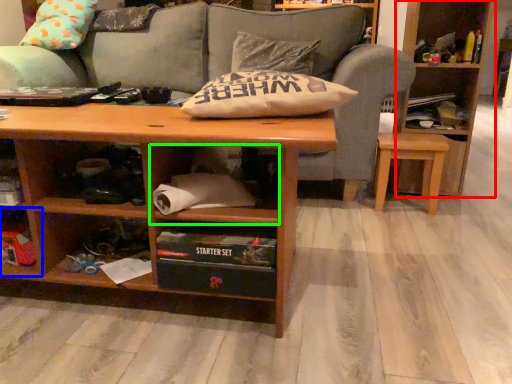
Question: Based on their relative distances, which object is farther from bookcase (highlighted by a red box)? Choose from shelf (highlighted by a blue box) and cabinet (highlighted by a green box).

Choices:
 (A) shelf
 (B) cabinet

Answer: (A)